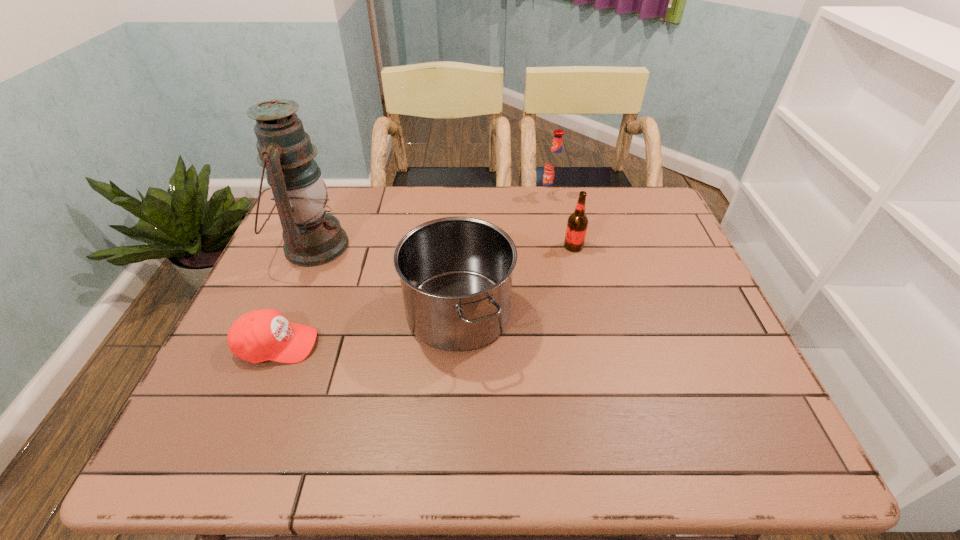
Identify the location of vacant space that satisfies the following two spatial constraints: 1. on the back side of the taller root beer; 2. on the right side of the tallest object. The width and height of the screenshot is (960, 540). (334, 197).

This screenshot has height=540, width=960. What are the coordinates of `vacant point that satisfies the following two spatial constraints: 1. on the front side of the farthest object; 2. on the front panel of the shortest object` in the screenshot? It's located at (581, 345).

The height and width of the screenshot is (540, 960). Identify the location of blank area in the image that satisfies the following two spatial constraints: 1. on the back side of the farther root beer; 2. on the right side of the oil lamp. (334, 197).